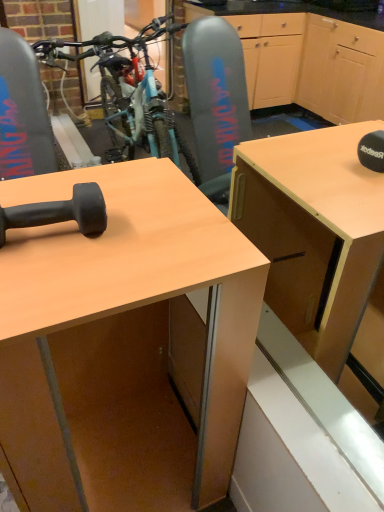
The height and width of the screenshot is (512, 384). I want to click on free space to the back side of black rubber dumbbell at lower left, so click(x=71, y=185).